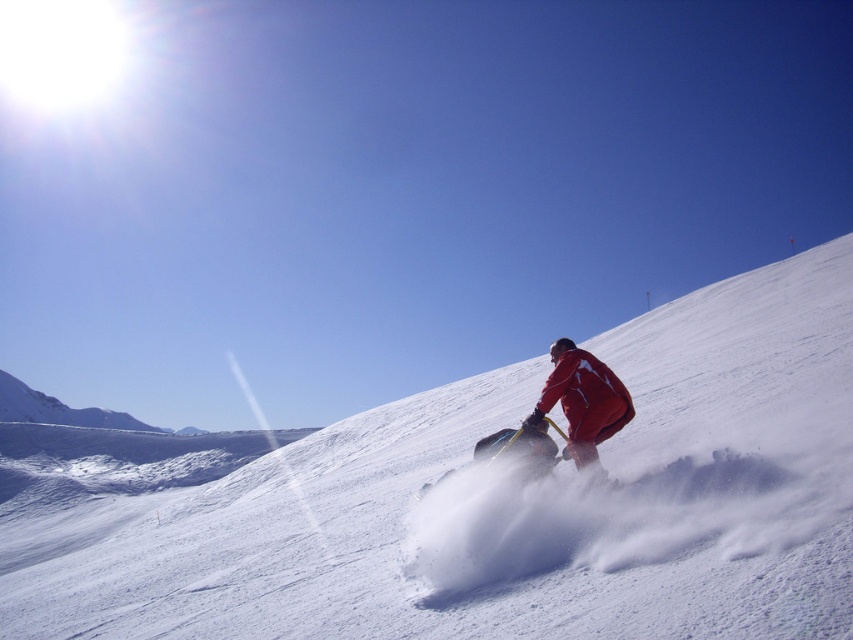
Is white powdery snow at center to the right of shiny black snowboard at center from the viewer's perspective?

In fact, white powdery snow at center is to the left of shiny black snowboard at center.

What do you see at coordinates (479, 500) in the screenshot? The height and width of the screenshot is (640, 853). I see `white powdery snow at center` at bounding box center [479, 500].

I want to click on white powdery snow at center, so click(x=479, y=500).

Does red matte jacket at center appear on the right side of shiny black snowboard at center?

Yes, red matte jacket at center is to the right of shiny black snowboard at center.

Is point (592, 396) positioned after point (537, 465)?

Yes, point (592, 396) is farther from viewer.

You are a GUI agent. You are given a task and a screenshot of the screen. Output one action in this format:
    pyautogui.click(x=<x>, y=<y>)
    Task: Click on the red matte jacket at center
    
    Given the screenshot: What is the action you would take?
    pyautogui.click(x=583, y=401)

Can you confirm if white powdery snow at center is shorter than red matte jacket at center?

Incorrect, white powdery snow at center's height does not fall short of red matte jacket at center's.

Is white powdery snow at center taller than red matte jacket at center?

Yes.

Where is `white powdery snow at center`? white powdery snow at center is located at coordinates (479, 500).

Where is `white powdery snow at center`? The width and height of the screenshot is (853, 640). white powdery snow at center is located at coordinates (479, 500).